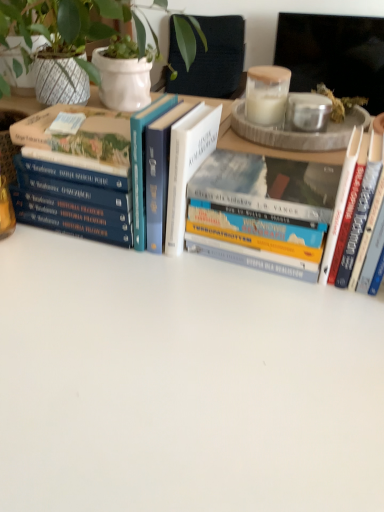
Question: Does hardcover book at left, acting as the first book starting from the left, have a lesser width compared to hardcover book at center, which is the 2th book in left-to-right order?

Choices:
 (A) no
 (B) yes

Answer: (B)

Question: Is hardcover book at left, acting as the first book starting from the left, looking in the opposite direction of hardcover book at center, which ranks as the second book in right-to-left order?

Choices:
 (A) no
 (B) yes

Answer: (A)

Question: Can you confirm if hardcover book at left, acting as the first book starting from the left, is bigger than hardcover book at center, which is the 2th book in left-to-right order?

Choices:
 (A) no
 (B) yes

Answer: (A)

Question: Does hardcover book at left, which is the third book in right-to-left order, touch hardcover book at center, which ranks as the second book in right-to-left order?

Choices:
 (A) no
 (B) yes

Answer: (A)

Question: Is hardcover book at left, acting as the first book starting from the left, not near hardcover book at center, which ranks as the second book in right-to-left order?

Choices:
 (A) yes
 (B) no

Answer: (B)

Question: Do you think hardcover book at right, which is the 3th book from left to right, is within hardcover book at left, acting as the first book starting from the left, or outside of it?

Choices:
 (A) outside
 (B) inside

Answer: (A)

Question: Is hardcover book at right, which is the 3th book from left to right, in front of or behind hardcover book at left, acting as the first book starting from the left, in the image?

Choices:
 (A) front
 (B) behind

Answer: (A)

Question: In terms of height, does hardcover book at right, which appears as the 1th book when viewed from the right, look taller or shorter compared to hardcover book at left, acting as the first book starting from the left?

Choices:
 (A) tall
 (B) short

Answer: (A)

Question: In terms of size, does hardcover book at right, which appears as the 1th book when viewed from the right, appear bigger or smaller than hardcover book at left, acting as the first book starting from the left?

Choices:
 (A) small
 (B) big

Answer: (B)

Question: From the image's perspective, is hardcover book at right, which is the 3th book from left to right, positioned above or below hardcover book at center, which ranks as the second book in right-to-left order?

Choices:
 (A) above
 (B) below

Answer: (B)

Question: Is hardcover book at right, which appears as the 1th book when viewed from the right, to the left or to the right of hardcover book at center, which is the 2th book in left-to-right order, in the image?

Choices:
 (A) left
 (B) right

Answer: (B)

Question: From a real-world perspective, is hardcover book at right, which appears as the 1th book when viewed from the right, positioned above or below hardcover book at center, which ranks as the second book in right-to-left order?

Choices:
 (A) above
 (B) below

Answer: (A)

Question: Is point (365, 181) positioned closer to the camera than point (284, 212)?

Choices:
 (A) farther
 (B) closer

Answer: (B)

Question: Is hardcover book at center, which ranks as the second book in right-to-left order, in front of or behind hardcover book at left, acting as the first book starting from the left, in the image?

Choices:
 (A) behind
 (B) front

Answer: (B)

Question: From their relative heights in the image, would you say hardcover book at center, which ranks as the second book in right-to-left order, is taller or shorter than hardcover book at left, acting as the first book starting from the left?

Choices:
 (A) tall
 (B) short

Answer: (A)